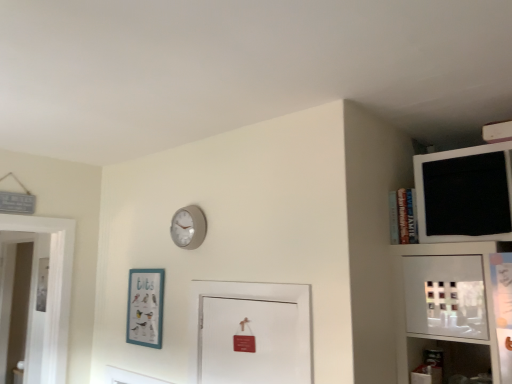
Question: Looking at their shapes, would you say matte gray clock at upper center is wider or thinner than black matte medicine cabinet at upper right?

Choices:
 (A) thin
 (B) wide

Answer: (A)

Question: From the image's perspective, relative to black matte medicine cabinet at upper right, is matte gray clock at upper center above or below?

Choices:
 (A) below
 (B) above

Answer: (A)

Question: Based on their relative distances, which object is nearer to the matte gray clock at upper center?

Choices:
 (A) black matte medicine cabinet at upper right
 (B) teal matte picture frame at lower left

Answer: (B)

Question: Considering the real-world distances, which object is closest to the teal matte picture frame at lower left?

Choices:
 (A) black matte medicine cabinet at upper right
 (B) matte gray clock at upper center

Answer: (B)